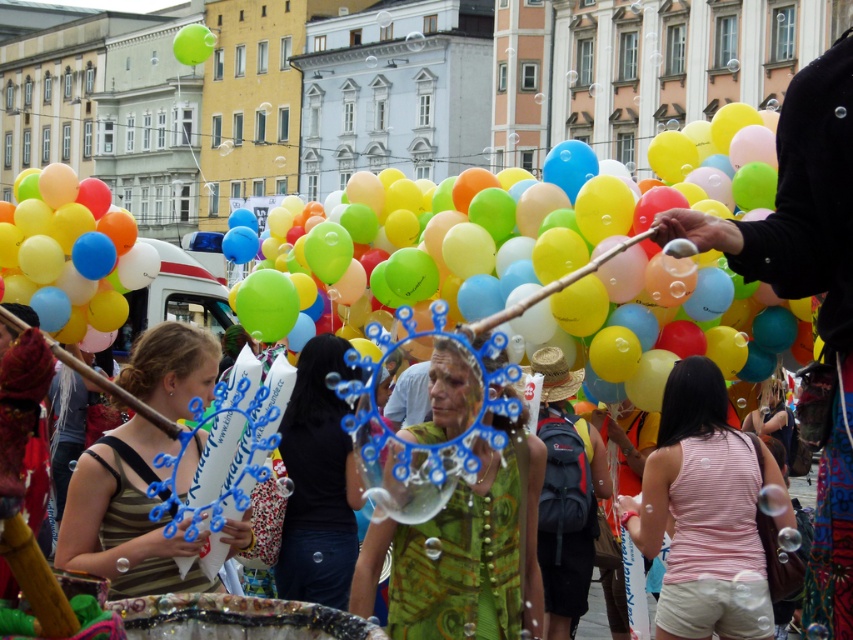
Question: Is rubber balloons at center closer to the viewer compared to matte rubber balloons at left?

Choices:
 (A) yes
 (B) no

Answer: (A)

Question: Which point is closer to the camera?

Choices:
 (A) (207, 49)
 (B) (45, 228)
 (C) (381, 284)
 (D) (573, 452)

Answer: (D)

Question: Which object is farther from the camera taking this photo?

Choices:
 (A) matte yellow balloon at upper center
 (B) straw hat at center

Answer: (A)

Question: Which of the following is the farthest from the observer?

Choices:
 (A) (200, 38)
 (B) (813, 580)
 (C) (379, 282)

Answer: (A)

Question: Is the position of black fabric at upper right less distant than that of rubber balloons at center?

Choices:
 (A) no
 (B) yes

Answer: (B)

Question: Does black fabric at upper right appear under rubber balloons at center?

Choices:
 (A) yes
 (B) no

Answer: (A)